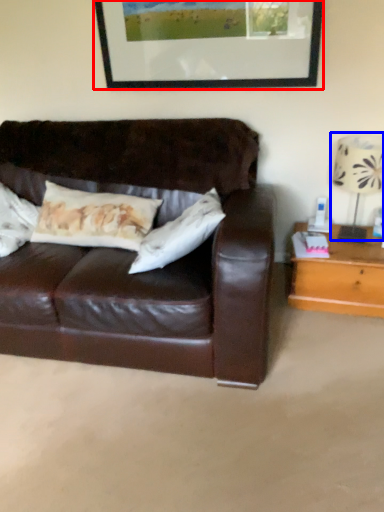
Question: Among these objects, which one is farthest to the camera, picture frame (highlighted by a red box) or table lamp (highlighted by a blue box)?

Choices:
 (A) picture frame
 (B) table lamp

Answer: (A)